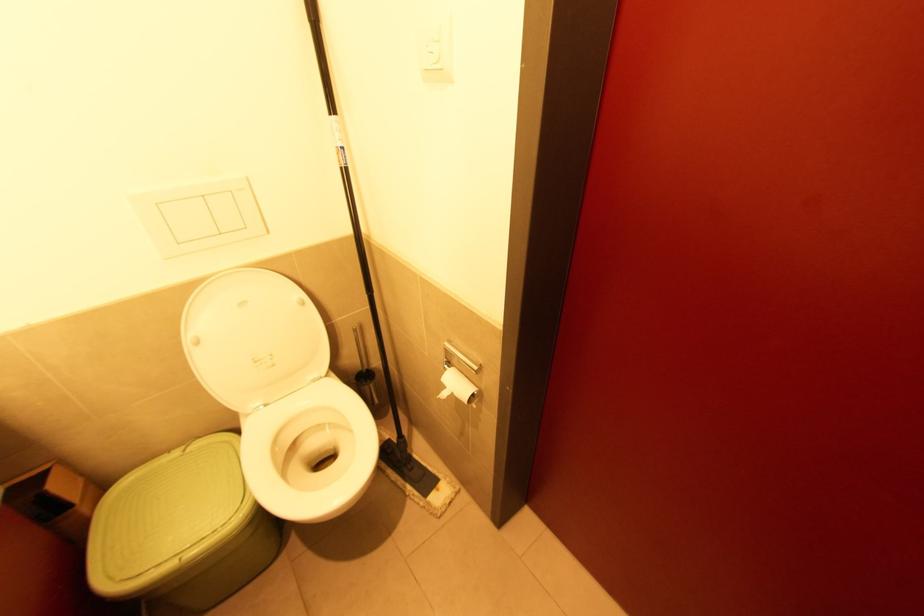
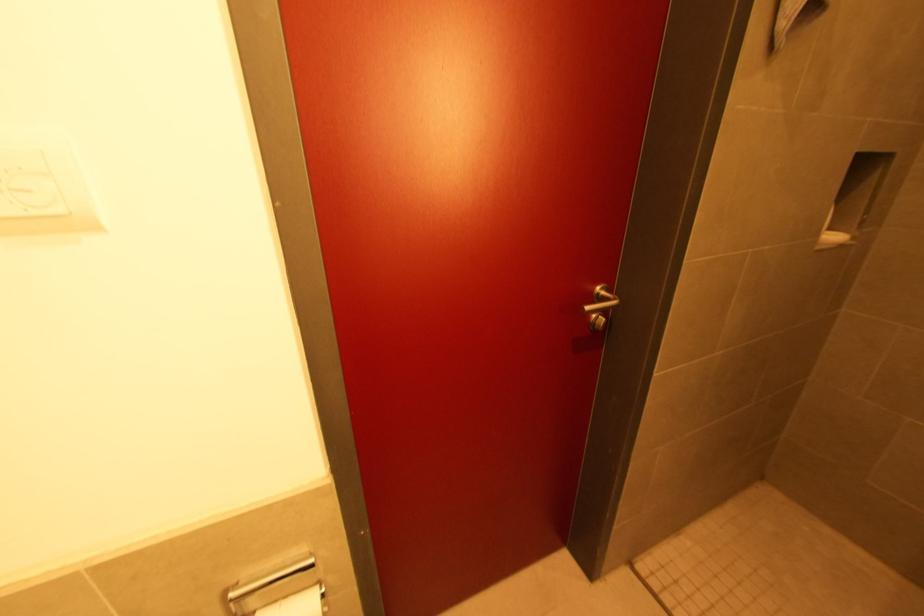
Question: The camera is either moving clockwise (left) or counter-clockwise (right) around the object. The first image is from the beginning of the video and the second image is from the end. Is the camera moving left or right when shooting the video?

Choices:
 (A) Left
 (B) Right

Answer: (A)